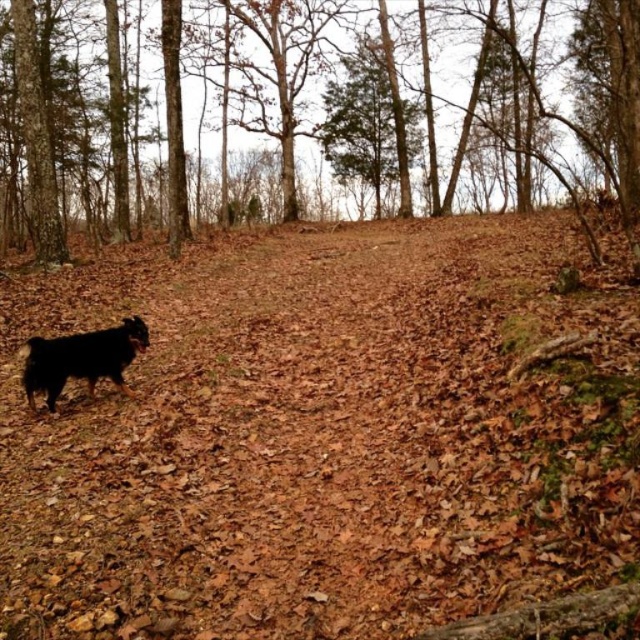
Looking at this image, you are standing in the forest and see the brown bark tree at left and the shaggy brown dog at lower left. Which object is located more to the left?

The brown bark tree at left is positioned more to the left than the shaggy brown dog at lower left.

You are standing in the forest and see the brown bark tree at left and the shaggy brown dog at lower left. Which object is closer to you?

The brown bark tree at left is closer to you than the shaggy brown dog at lower left because the dog is behind the tree.